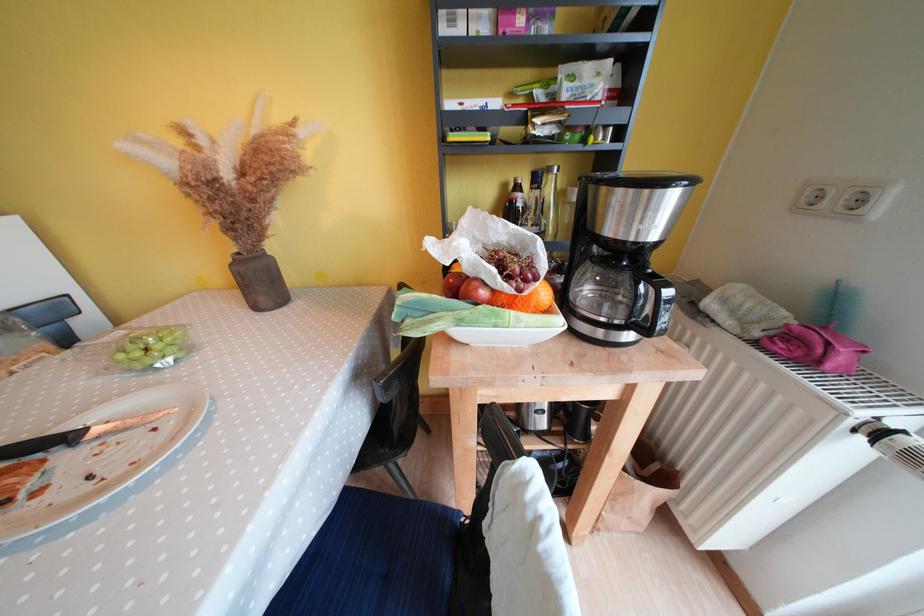
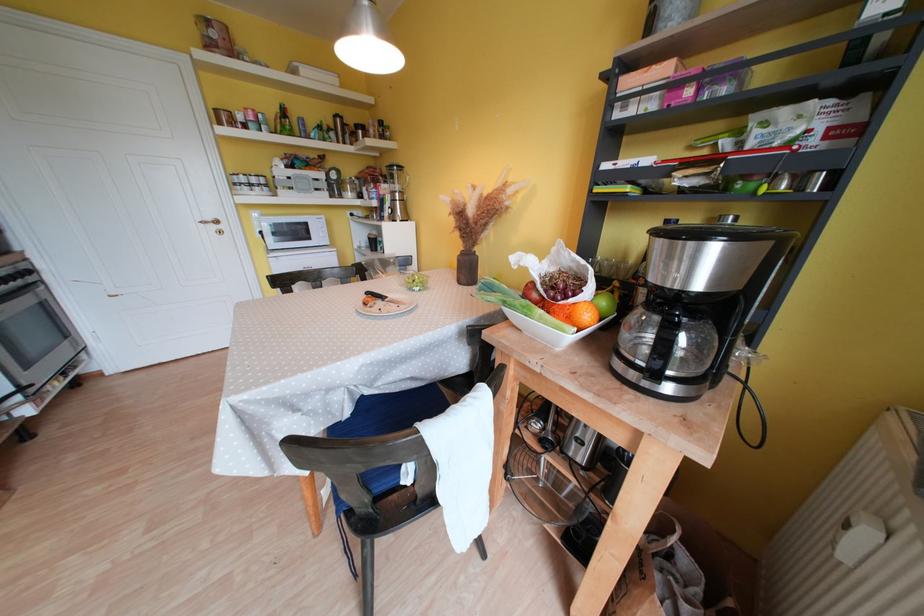
Locate, in the second image, the point that corresponds to (630,246) in the first image.

(669, 292)